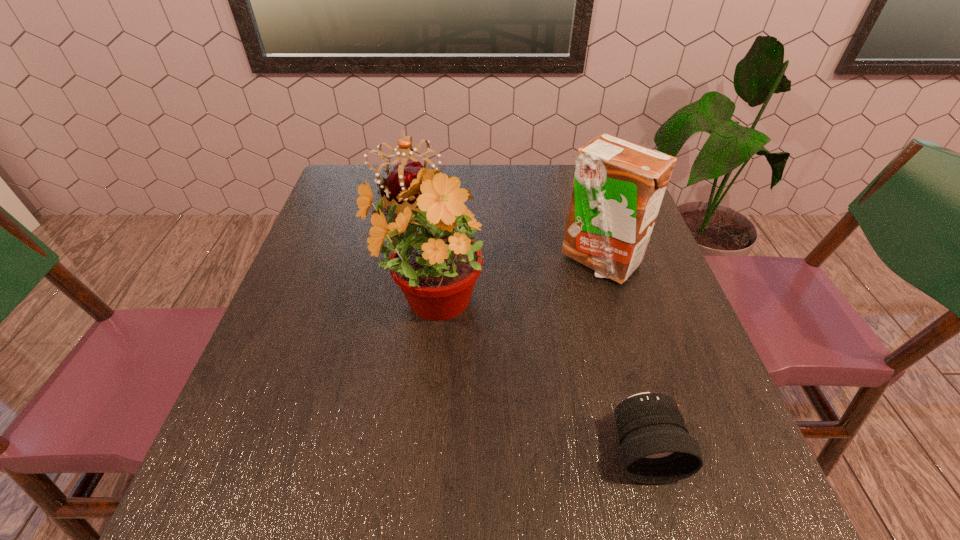
In the image, there is a desktop. At what (x,y) coordinates should I click in order to perform the action: click on vacant space at the far left corner. Please return your answer as a coordinate pair (x, y). Looking at the image, I should click on (384, 172).

This screenshot has height=540, width=960. Find the location of `vacant point located between the second tallest object and the shortest object`. vacant point located between the second tallest object and the shortest object is located at coordinates (621, 356).

I want to click on vacant region between the nearest object and the tallest object, so click(536, 376).

Image resolution: width=960 pixels, height=540 pixels. Identify the location of unoccupied area between the tallest object and the second tallest object. (514, 281).

The image size is (960, 540). Identify the location of vacant area between the shortest object and the third tallest object. (525, 325).

You are a GUI agent. You are given a task and a screenshot of the screen. Output one action in this format:
    pyautogui.click(x=<x>, y=<y>)
    Task: Click on the empty space that is in between the farthest object and the nearest object
    The height and width of the screenshot is (540, 960).
    Given the screenshot: What is the action you would take?
    pyautogui.click(x=525, y=325)

The height and width of the screenshot is (540, 960). Identify the location of free point between the second tallest object and the farthest object. (503, 229).

Locate an element on the screen. This screenshot has height=540, width=960. vacant space that is in between the second tallest object and the farthest object is located at coordinates (503, 229).

Find the location of `free space between the farthest object and the carton`. free space between the farthest object and the carton is located at coordinates (503, 229).

This screenshot has height=540, width=960. Find the location of `free point between the telephoto lens and the second shortest object`. free point between the telephoto lens and the second shortest object is located at coordinates (525, 325).